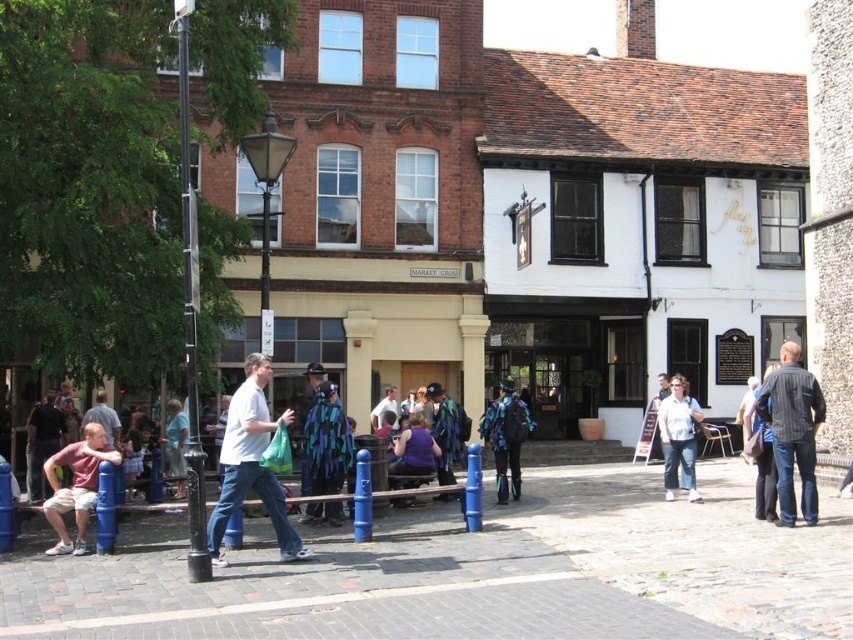
Question: Does dark blue jeans at center have a greater width compared to blue painted metal pole at center?

Choices:
 (A) yes
 (B) no

Answer: (A)

Question: In this image, where is shiny metallic jacket at center located relative to white shirt at center?

Choices:
 (A) below
 (B) above

Answer: (B)

Question: Which object is positioned closest to the brick pavement at center?

Choices:
 (A) striped denim shirt at right
 (B) black metal pole at left
 (C) purple matte shirt at center
 (D) dark blue jeans at center

Answer: (C)

Question: Which point is farther to the camera?

Choices:
 (A) (798, 435)
 (B) (439, 454)
 (C) (766, 477)

Answer: (B)

Question: Among these points, which one is farthest from the camera?

Choices:
 (A) (759, 444)
 (B) (222, 442)

Answer: (B)

Question: Can you confirm if matte pink shirt at lower left is thinner than purple matte shirt at center?

Choices:
 (A) yes
 (B) no

Answer: (A)